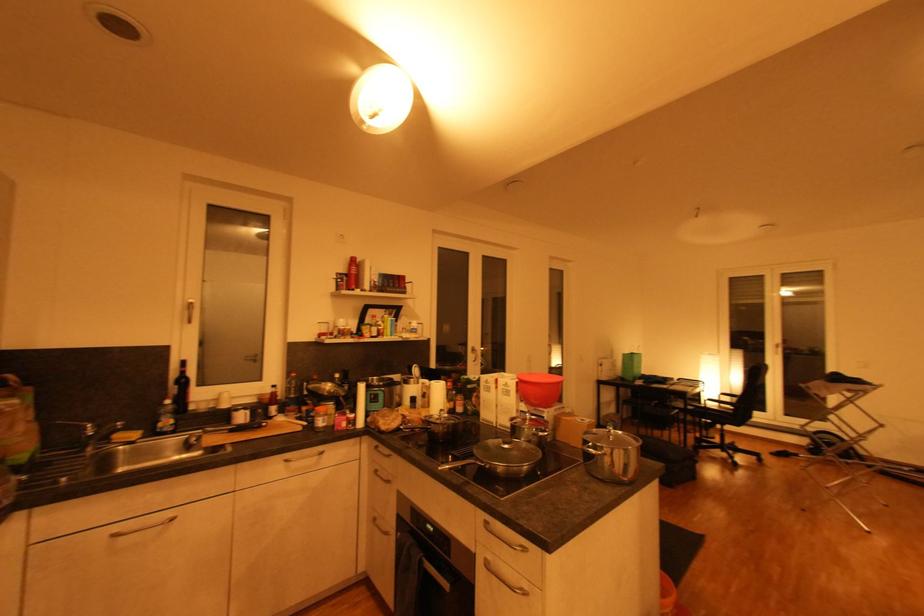
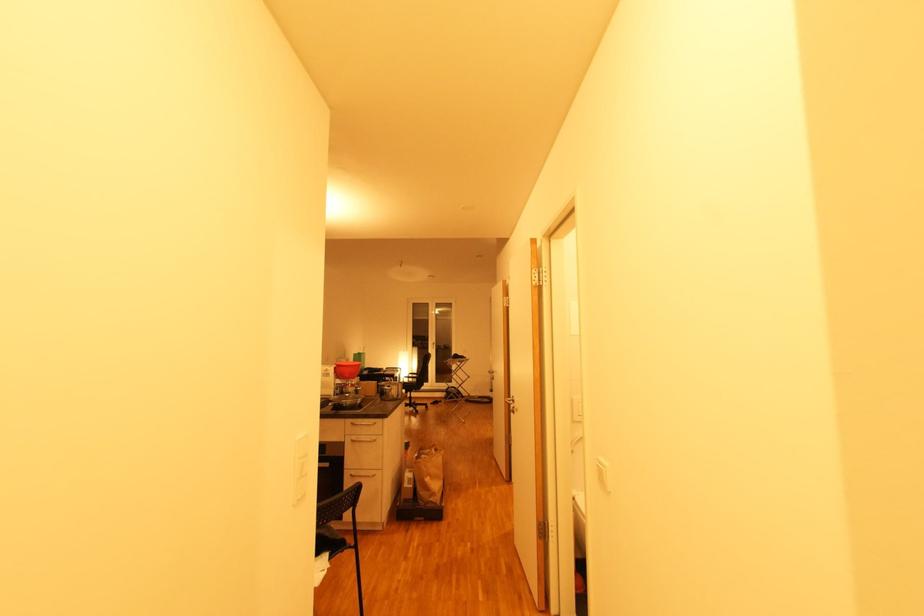
Where in the second image is the point corresponding to (528,408) from the first image?

(343, 382)